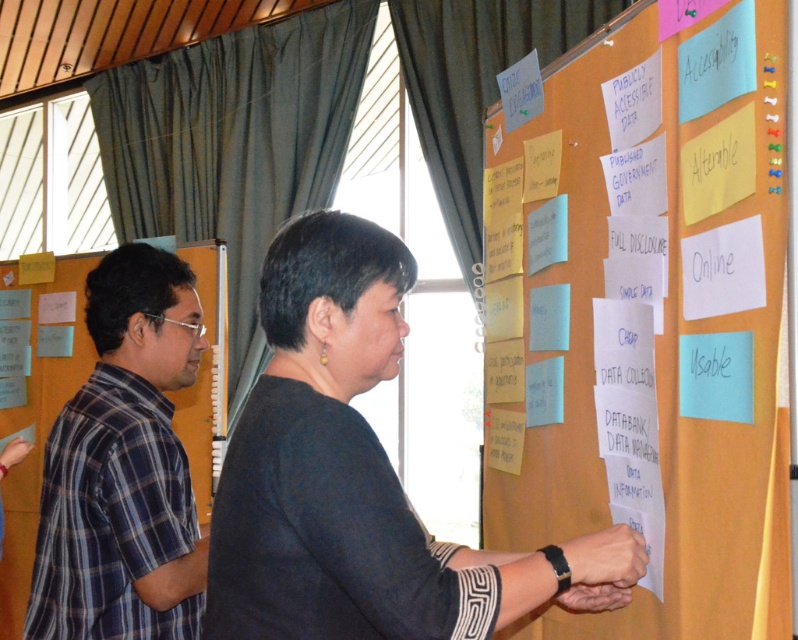
You are a photographer standing at the camera position. You want to take a photo of the brainstorming session. The focus point is at point (x=330, y=358). If your camera has a depth of field that can clearly capture objects within 1.2 meters from the focus point, will the two people in the scene be in focus?

The point (x=330, y=358) and camera are 1.22 meters apart. Since the depth of field can capture up to 1.2 meters, the two people will not be in focus as they are slightly beyond the 1.2 meter limit.

You are a project manager who needs to place a 30 inch wide poster between the light brown corkboard at upper right and the plaid shirt at left. Will there be enough space?

The light brown corkboard at upper right is 33.42 inches from the plaid shirt at left. Since the poster is 30 inches wide, there is enough space to place it between them.

Consider the image. You are standing in front of the orange bulletin board and want to hand a sticky note to the person wearing the dark gray sweater at center. Which direction should you move to reach them first, considering their positions relative to the plaid shirt at left?

The dark gray sweater at center is located above the plaid shirt at left, so you should move towards the upper area near the plaid shirt at left to reach the dark gray sweater at center first.